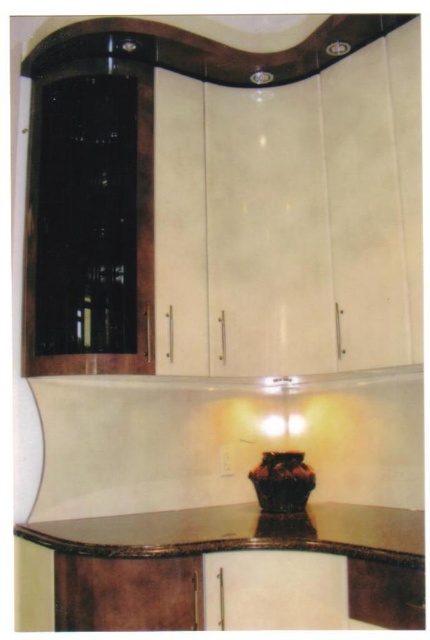
The image size is (430, 640). What do you see at coordinates (240, 532) in the screenshot?
I see `brown marble countertop at center` at bounding box center [240, 532].

Who is positioned more to the right, brown marble countertop at center or brown glossy vase at center?

brown glossy vase at center

The width and height of the screenshot is (430, 640). In order to click on brown marble countertop at center in this screenshot , I will do `click(240, 532)`.

You are a GUI agent. You are given a task and a screenshot of the screen. Output one action in this format:
    pyautogui.click(x=<x>, y=<y>)
    Task: Click on the brown marble countertop at center
    The image size is (430, 640).
    Given the screenshot: What is the action you would take?
    pyautogui.click(x=240, y=532)